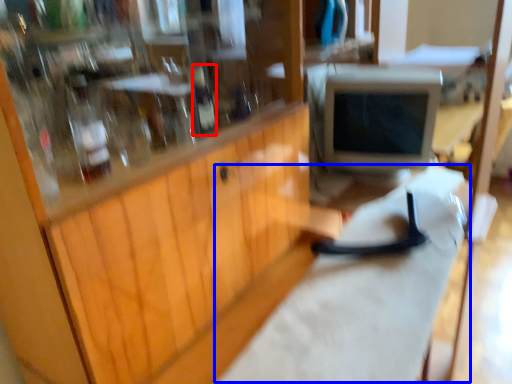
Question: Which object appears closest to the camera in this image, bottle (highlighted by a red box) or workbench (highlighted by a blue box)?

Choices:
 (A) bottle
 (B) workbench

Answer: (B)